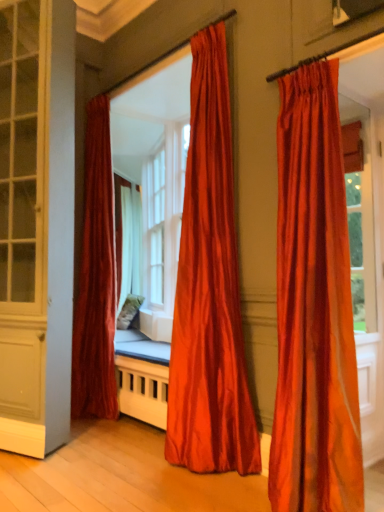
Question: In terms of width, does satin orange curtain at center, arranged as the second curtain when viewed from the front, look wider or thinner when compared to white glass bay window at center?

Choices:
 (A) wide
 (B) thin

Answer: (A)

Question: Based on their sizes in the image, would you say satin orange curtain at center, placed as the 2th curtain when sorted from left to right, is bigger or smaller than white glass bay window at center?

Choices:
 (A) big
 (B) small

Answer: (B)

Question: Which of these objects is positioned closest to the white glass bay window at center?

Choices:
 (A) satin red curtain at left, which is counted as the 1th curtain, starting from the back
 (B) matte white screen door at left
 (C) satin orange curtain at right, which appears as the third curtain when viewed from the left
 (D) satin orange curtain at center, placed as the 2th curtain when sorted from left to right

Answer: (A)

Question: Which is nearer to the satin red curtain at left, the 1th curtain in the left-to-right sequence?

Choices:
 (A) white glass bay window at center
 (B) satin orange curtain at right, which is the first curtain in front-to-back order
 (C) matte white screen door at left
 (D) satin orange curtain at center, placed as the 2th curtain when sorted from left to right

Answer: (C)